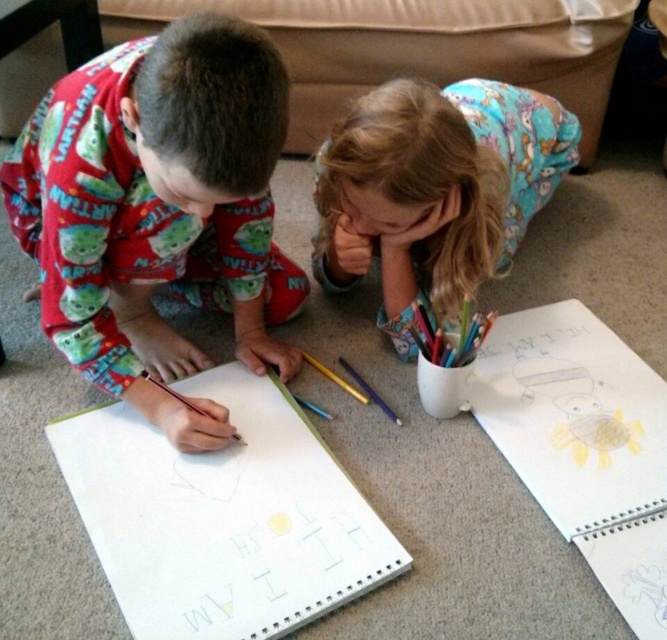
Does fluffy blue pajamas at center come behind matte yellow crayon at center?

No, it is in front of matte yellow crayon at center.

The height and width of the screenshot is (640, 667). What do you see at coordinates (436, 189) in the screenshot? I see `fluffy blue pajamas at center` at bounding box center [436, 189].

Locate an element on the screen. fluffy blue pajamas at center is located at coordinates (436, 189).

Where is `fluffy blue pajamas at center`? The image size is (667, 640). fluffy blue pajamas at center is located at coordinates (436, 189).

Between point (251, 45) and point (309, 438), which one is positioned behind?

The point (309, 438) is behind.

Between red cotton pajamas at left and white paper at center, which one appears on the left side from the viewer's perspective?

From the viewer's perspective, red cotton pajamas at left appears more on the left side.

Does point (239, 276) lie in front of point (303, 490)?

No, it is behind (303, 490).

Where is `red cotton pajamas at left`? This screenshot has width=667, height=640. red cotton pajamas at left is located at coordinates (157, 211).

Does point (125, 424) come closer to viewer compared to point (364, 264)?

Yes, point (125, 424) is in front of point (364, 264).

This screenshot has height=640, width=667. I want to click on white paper at center, so pyautogui.click(x=221, y=516).